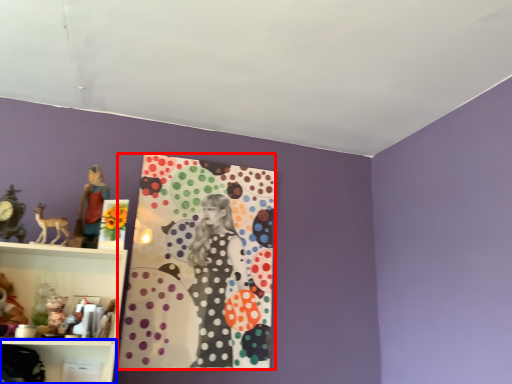
Question: Which object is closer to the camera taking this photo, design (highlighted by a red box) or shelf (highlighted by a blue box)?

Choices:
 (A) design
 (B) shelf

Answer: (B)